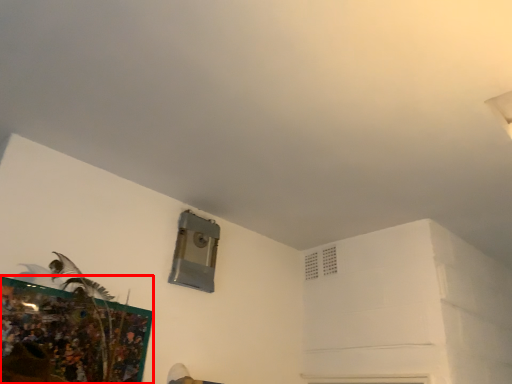
Question: From the image's perspective, what is the correct spatial positioning of picture frame (annotated by the red box) in reference to air conditioning?

Choices:
 (A) above
 (B) below

Answer: (B)